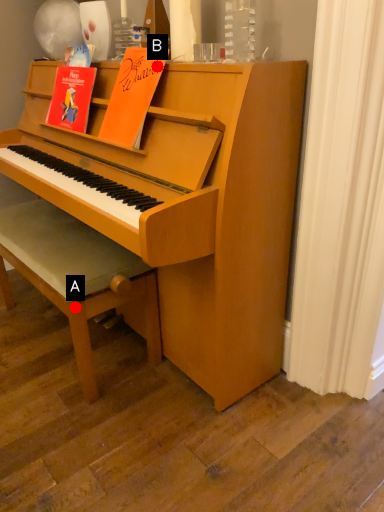
Question: Two points are circled on the image, labeled by A and B beside each circle. Which point is farther from the camera taking this photo?

Choices:
 (A) A is further
 (B) B is further

Answer: (A)